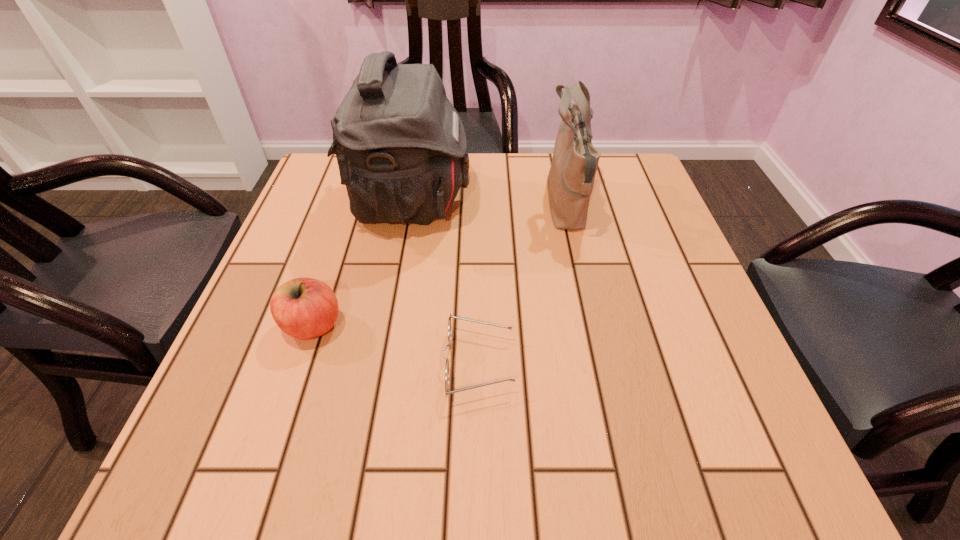
The image size is (960, 540). I want to click on vacant point located 0.280m on the back of the second shortest object, so click(349, 213).

Locate an element on the screen. This screenshot has height=540, width=960. free space located on the front-facing side of the shortest object is located at coordinates (612, 364).

Where is `shoulder bag present at the left edge`? shoulder bag present at the left edge is located at coordinates (401, 148).

This screenshot has height=540, width=960. I want to click on apple that is positioned at the left edge, so click(x=304, y=308).

Identify the location of object that is at the far left corner. (401, 148).

What are the coordinates of `free space at the far edge` in the screenshot? It's located at (524, 163).

Locate an element on the screen. free location at the left edge is located at coordinates (312, 256).

Identify the location of vacant region at the right edge of the desktop. This screenshot has height=540, width=960. (710, 340).

The height and width of the screenshot is (540, 960). Identify the location of free region at the far left corner. (333, 159).

In the image, there is a desktop. Identify the location of free space at the far right corner. This screenshot has width=960, height=540. (615, 157).